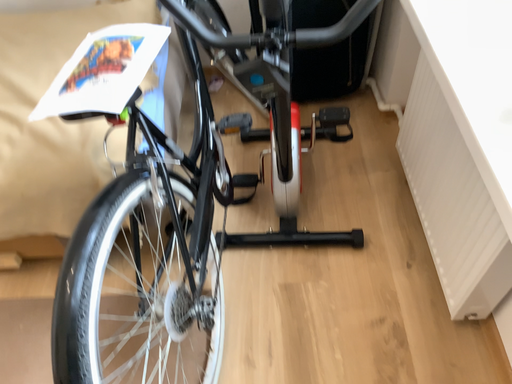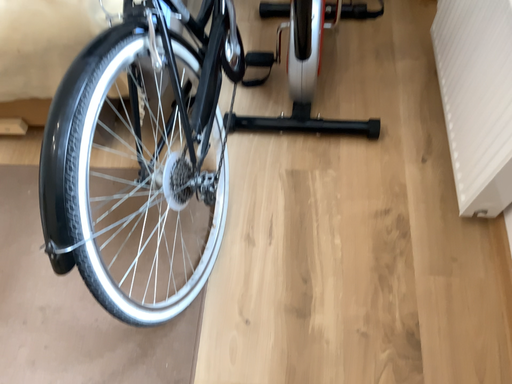
Question: Which way did the camera rotate in the video?

Choices:
 (A) rotated downward
 (B) rotated upward

Answer: (A)